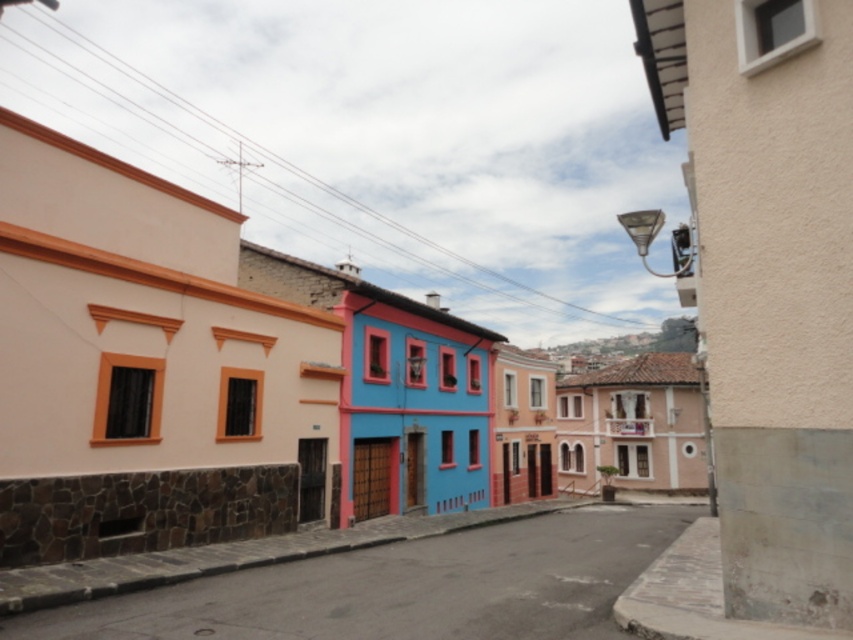
Is smooth stucco building at center wider than smooth concrete pavement at center?

Yes.

Which is behind, point (233, 321) or point (604, 548)?

The point (604, 548) is behind.

From the picture: Measure the distance between smooth stucco building at center and camera.

They are 8.50 meters apart.

The image size is (853, 640). In order to click on smooth stucco building at center in this screenshot , I will do `click(189, 371)`.